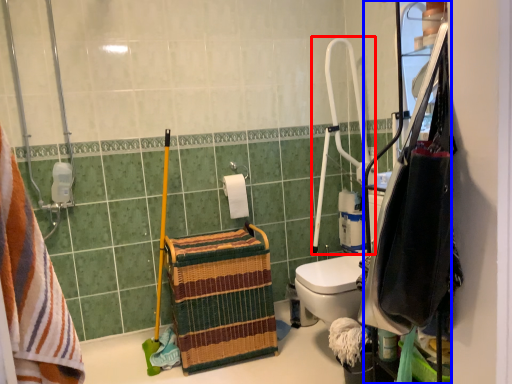
Question: Among these objects, which one is nearest to the camera, shower (highlighted by a red box) or cabinetry (highlighted by a blue box)?

Choices:
 (A) shower
 (B) cabinetry

Answer: (B)